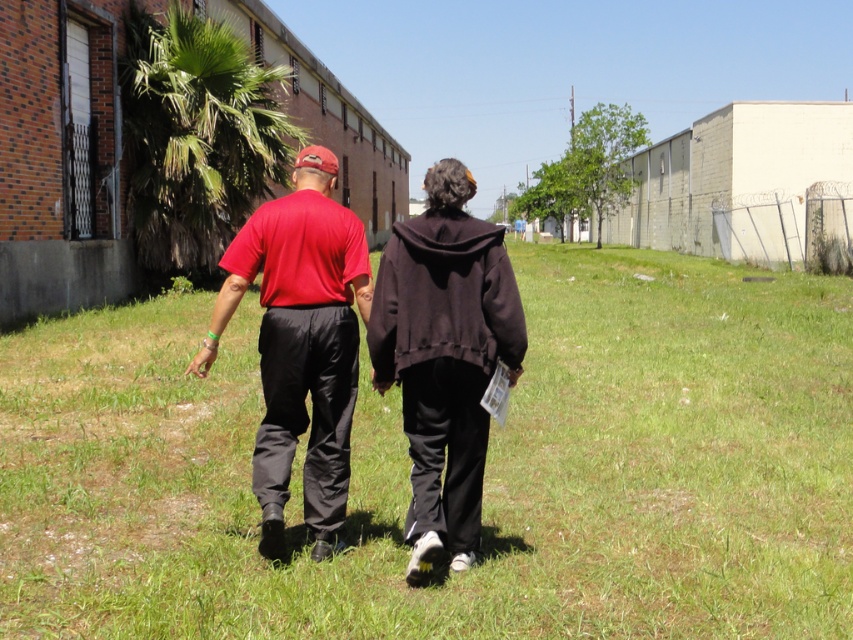
Image resolution: width=853 pixels, height=640 pixels. What do you see at coordinates (485, 474) in the screenshot?
I see `green grass at center` at bounding box center [485, 474].

Between green grass at center and black matte hoodie at center, which one is positioned higher?

Positioned higher is green grass at center.

Describe the element at coordinates (485, 474) in the screenshot. I see `green grass at center` at that location.

Identify the location of green grass at center. Image resolution: width=853 pixels, height=640 pixels. (485, 474).

Which of these two, green grass at center or matte red shirt at center, stands taller?

Standing taller between the two is green grass at center.

Measure the distance from green grass at center to matte red shirt at center.

green grass at center is 24.62 feet from matte red shirt at center.

The width and height of the screenshot is (853, 640). Describe the element at coordinates (485, 474) in the screenshot. I see `green grass at center` at that location.

Locate an element on the screen. green grass at center is located at coordinates (485, 474).

Is the position of black matte hoodie at center less distant than that of matte red shirt at center?

Yes.

Image resolution: width=853 pixels, height=640 pixels. I want to click on black matte hoodie at center, so click(444, 356).

Which is in front, point (463, 172) or point (326, 241)?

Point (463, 172) is more forward.

You are a GUI agent. You are given a task and a screenshot of the screen. Output one action in this format:
    pyautogui.click(x=<x>, y=<y>)
    Task: Click on the black matte hoodie at center
    
    Given the screenshot: What is the action you would take?
    pyautogui.click(x=444, y=356)